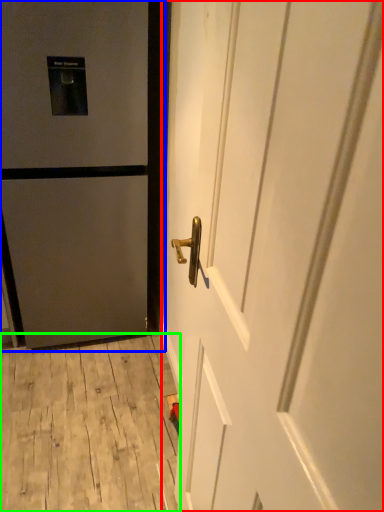
Question: Estimate the real-world distances between objects in this image. Which object is farther from door (highlighted by a red box), door (highlighted by a blue box) or plywood (highlighted by a green box)?

Choices:
 (A) door
 (B) plywood

Answer: (B)